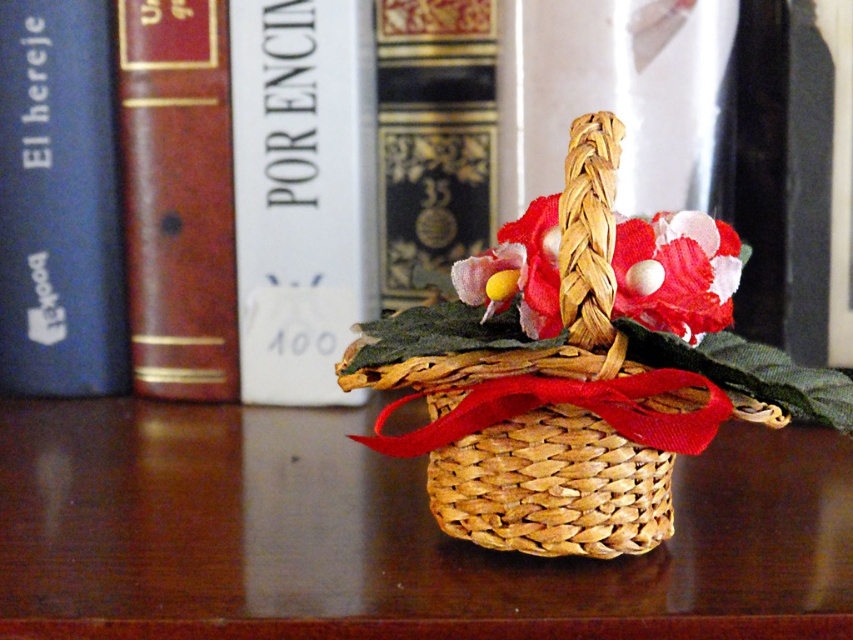
Does white paper at upper center appear over blue hardcover book at left?

No.

Is white paper at upper center thinner than blue hardcover book at left?

No.

Does point (321, 80) lie behind point (71, 109)?

No, (321, 80) is in front of (71, 109).

Locate an element on the screen. The height and width of the screenshot is (640, 853). white paper at upper center is located at coordinates (302, 193).

Between brown leather book at left and matte floral decoration at center, which one appears on the left side from the viewer's perspective?

Positioned to the left is brown leather book at left.

The width and height of the screenshot is (853, 640). Identify the location of brown leather book at left. (178, 196).

You are a GUI agent. You are given a task and a screenshot of the screen. Output one action in this format:
    pyautogui.click(x=<x>, y=<y>)
    Task: Click on the brown leather book at left
    The image size is (853, 640).
    Given the screenshot: What is the action you would take?
    pyautogui.click(x=178, y=196)

Is woven wood basket at center further to camera compared to matte floral decoration at center?

No, it is not.

Image resolution: width=853 pixels, height=640 pixels. Identify the location of woven wood basket at center. (383, 536).